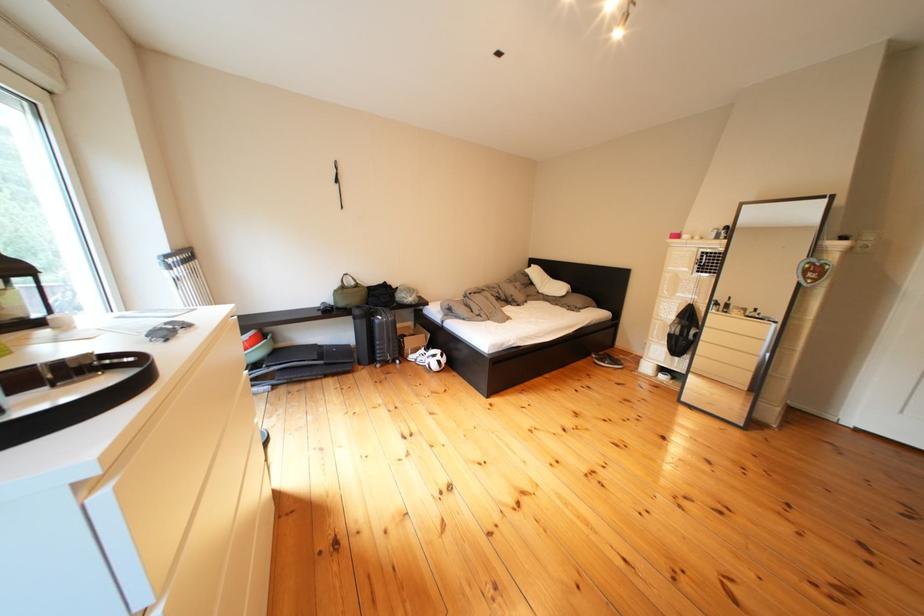
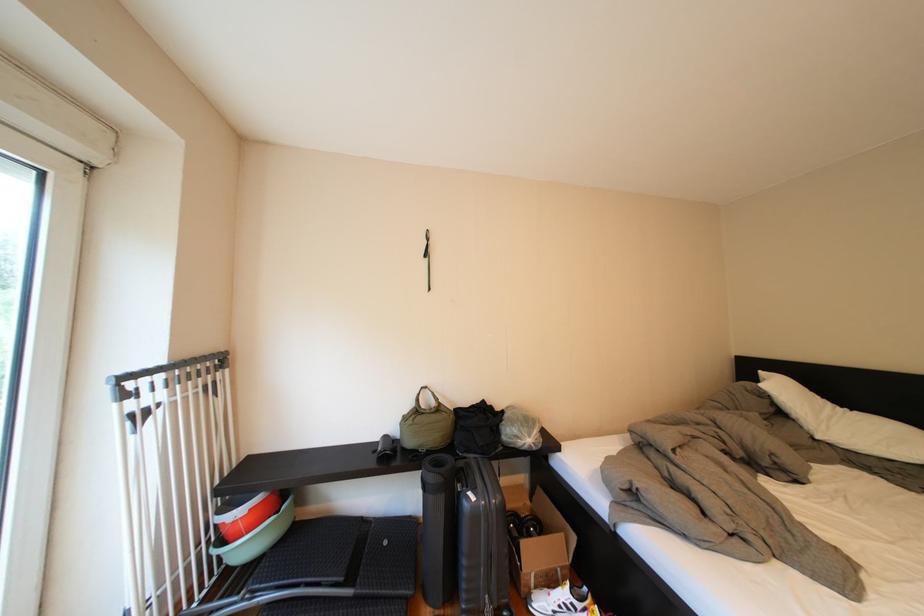
Find the pixel in the second image that matches (338,369) in the first image.

(370, 602)